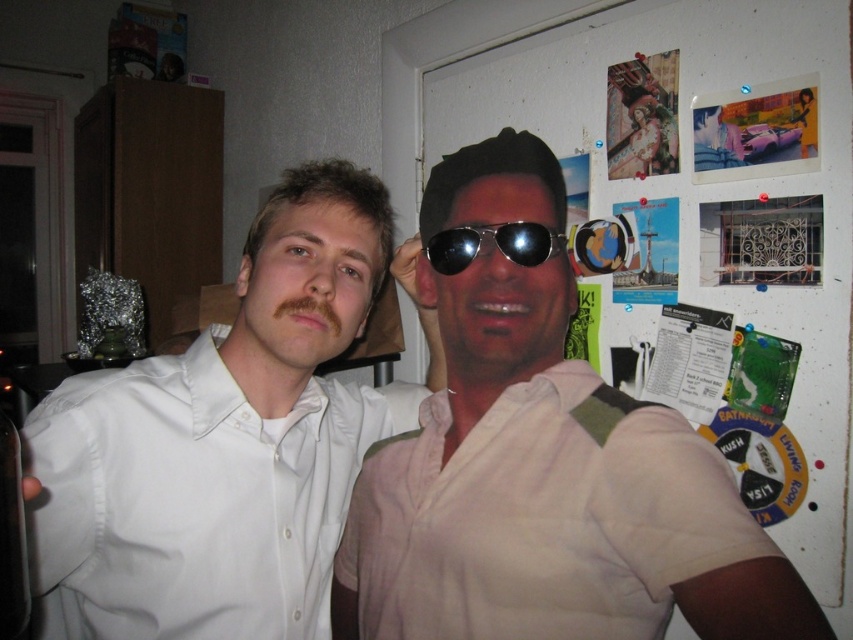
You are a photographer trying to capture a closeup of the metallic reflective sunglasses at center without including the beige cotton shirt at center in the frame. Is this possible given their positions?

The beige cotton shirt at center is positioned on the right side of metallic reflective sunglasses at center, so it is likely blocking part of the sunglasses. Therefore, capturing a closeup of the metallic reflective sunglasses at center without including the beige cotton shirt at center may not be possible due to their spatial arrangement.

You are a photographer standing 10 feet away from the two people in the image. You want to take a photo that includes both the light beige shirt at center and the white smooth shirt at left in the same frame. Given that your camera has a 50mm lens, which has a field of view of approximately 46 degrees, will both shirts fit within the camera frame?

The light beige shirt at center and white smooth shirt at left are 8.51 inches apart. At 10 feet away, the maximum width the camera can capture with a 50mm lens is about 10.6 feet. Since 8.51 inches is much smaller than 10.6 feet, both shirts will easily fit within the camera frame.

You are trying to decide which item is larger between the beige cotton shirt at center and the metallic reflective sunglasses at center. Based on the scene described, which one has a greater size?

The beige cotton shirt at center is bigger than the metallic reflective sunglasses at center, so the beige cotton shirt at center is larger.